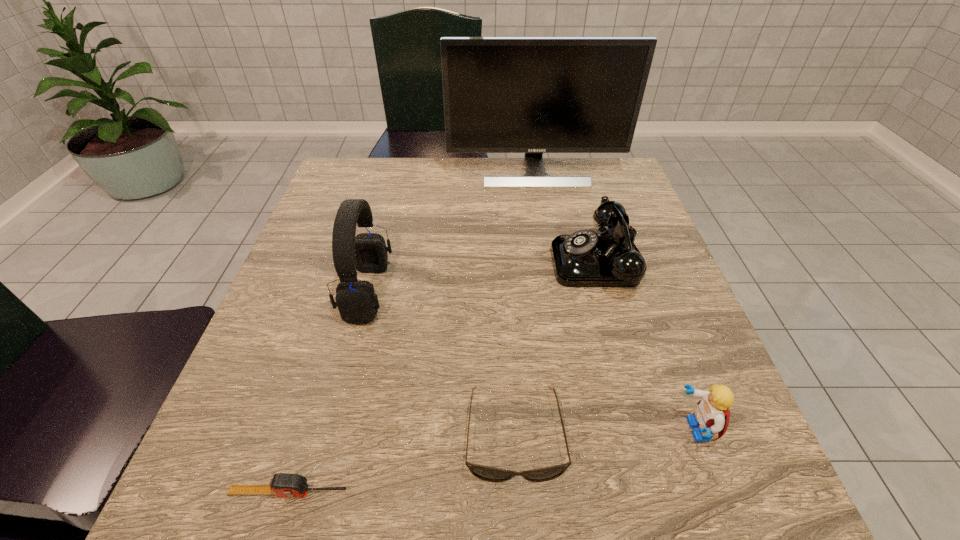
This screenshot has height=540, width=960. What are the coordinates of `vacant space at the far right corner of the desktop` in the screenshot? It's located at tap(612, 193).

You are a GUI agent. You are given a task and a screenshot of the screen. Output one action in this format:
    pyautogui.click(x=<x>, y=<y>)
    Task: Click on the free point at the near right corner
    Image resolution: width=960 pixels, height=540 pixels.
    Given the screenshot: What is the action you would take?
    pyautogui.click(x=732, y=500)

Where is `unoccupied position between the monitor and the sunglasses`? Image resolution: width=960 pixels, height=540 pixels. unoccupied position between the monitor and the sunglasses is located at coordinates (525, 303).

Where is `free space between the Lego and the sunglasses`? free space between the Lego and the sunglasses is located at coordinates (605, 432).

Where is `vacant region between the telephone and the Lego`? The image size is (960, 540). vacant region between the telephone and the Lego is located at coordinates (647, 346).

At what (x,y) coordinates should I click in order to perform the action: click on blank region between the sunglasses and the tape measure. Please return your answer as a coordinate pair (x, y). Image resolution: width=960 pixels, height=540 pixels. Looking at the image, I should click on (401, 463).

You are a GUI agent. You are given a task and a screenshot of the screen. Output one action in this format:
    pyautogui.click(x=<x>, y=<y>)
    Task: Click on the empty space that is in between the fifth shortest object and the tallest object
    The height and width of the screenshot is (540, 960).
    Given the screenshot: What is the action you would take?
    pyautogui.click(x=451, y=232)

Locate an element on the screen. The image size is (960, 540). free spot between the headset and the sunglasses is located at coordinates (441, 363).

The height and width of the screenshot is (540, 960). I want to click on empty location between the sunglasses and the Lego, so click(605, 432).

I want to click on unoccupied position between the fifth shortest object and the tape measure, so click(328, 392).